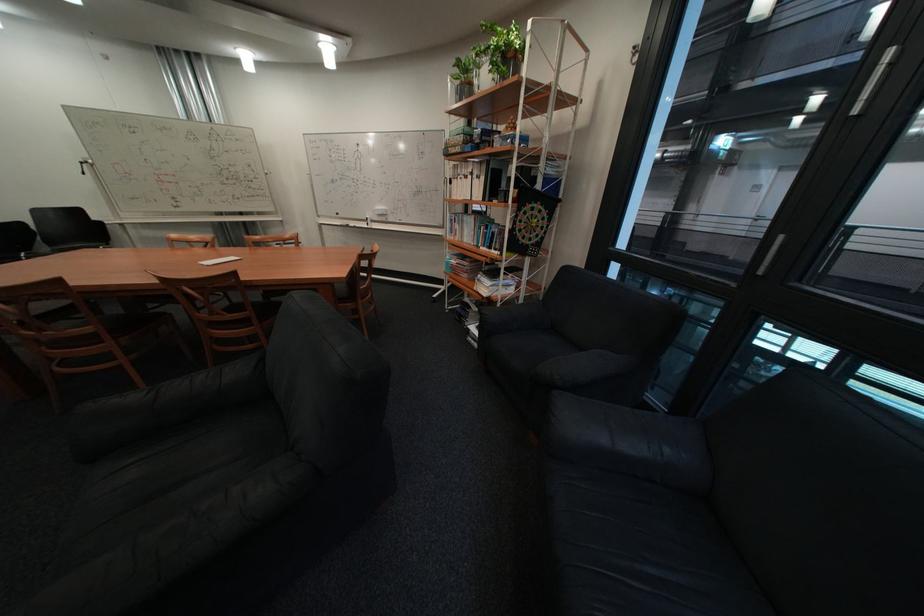
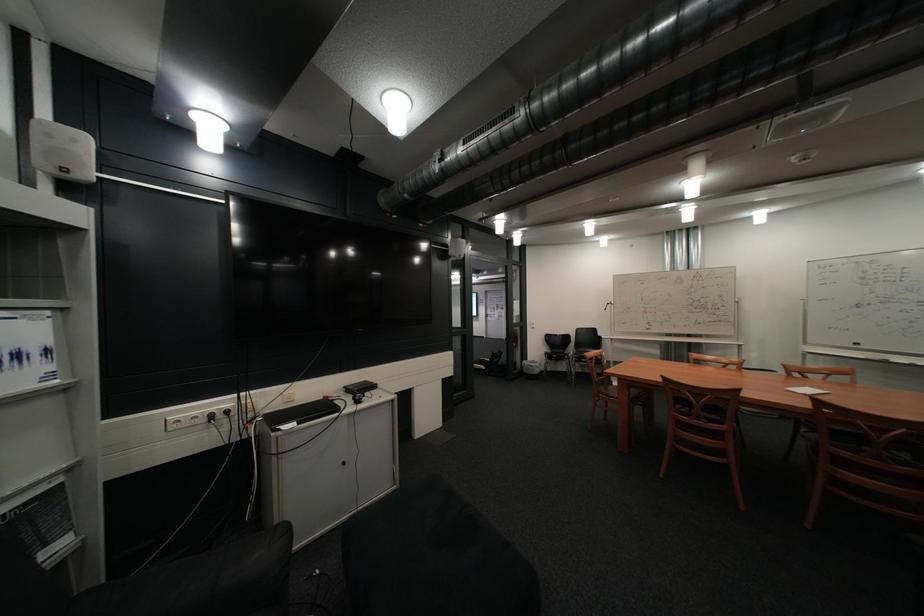
Locate, in the second image, the point that corresponds to [232,315] in the first image.

(888, 460)